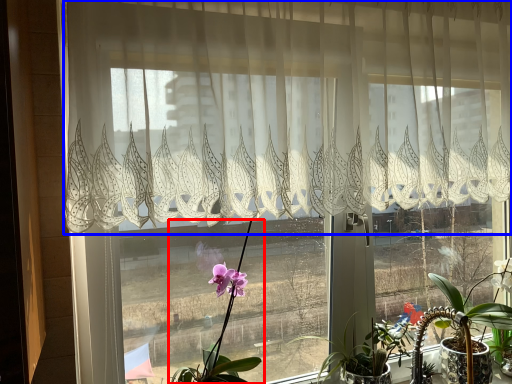
Question: Which object appears farthest to the camera in this image, houseplant (highlighted by a red box) or curtain (highlighted by a blue box)?

Choices:
 (A) houseplant
 (B) curtain

Answer: (A)